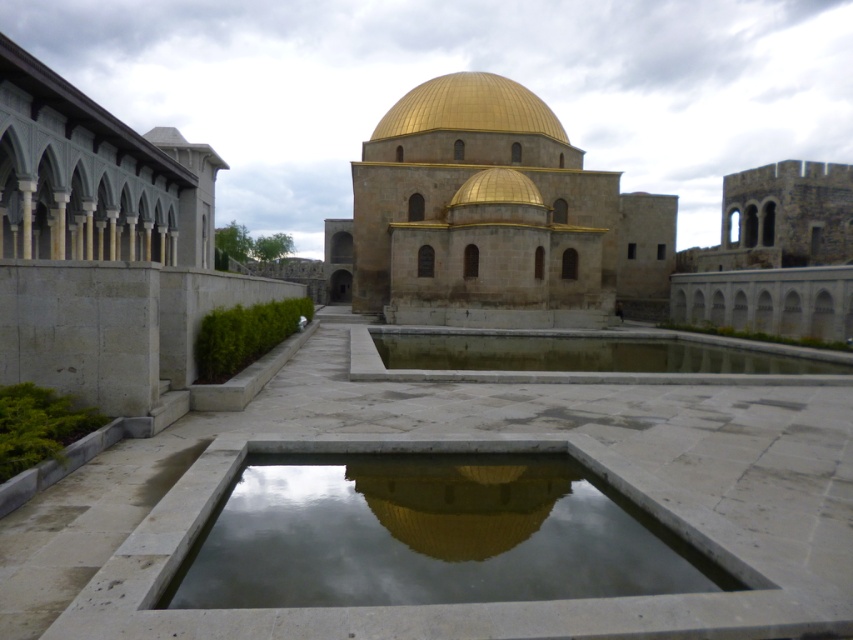
Question: Does gold stone dome at center lie behind clear stone pond at center?

Choices:
 (A) no
 (B) yes

Answer: (B)

Question: Is smooth concrete pond at center bigger than gold polished dome at center?

Choices:
 (A) no
 (B) yes

Answer: (A)

Question: Which object is positioned farthest from the clear stone pond at center?

Choices:
 (A) smooth concrete pond at center
 (B) gold polished dome at center
 (C) gold stone dome at center

Answer: (B)

Question: Which point appears farthest from the camera in this image?

Choices:
 (A) (523, 262)
 (B) (517, 120)

Answer: (B)

Question: Is the position of gold stone dome at center less distant than that of clear stone pond at center?

Choices:
 (A) no
 (B) yes

Answer: (A)

Question: Based on their relative distances, which object is farther from the clear stone pond at center?

Choices:
 (A) gold polished dome at center
 (B) gold stone dome at center
 (C) smooth concrete pond at center

Answer: (A)